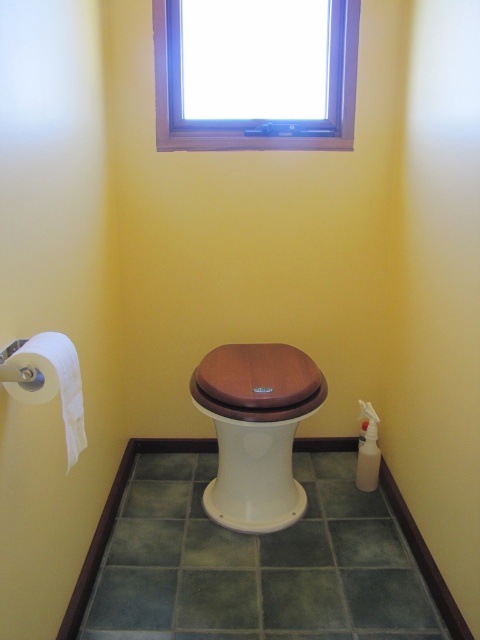
Which of these two, wooden frame at upper center or white paper at left, stands taller?

With more height is wooden frame at upper center.

Is point (300, 67) more distant than point (43, 365)?

Yes, point (300, 67) is farther from viewer.

Is point (235, 148) positioned behind point (69, 362)?

Yes, point (235, 148) is farther from viewer.

Where is `wooden frame at upper center`? wooden frame at upper center is located at coordinates (254, 74).

Image resolution: width=480 pixels, height=640 pixels. Describe the element at coordinates (257, 374) in the screenshot. I see `wooden toilet lid at center` at that location.

Based on the photo, does wooden toilet lid at center have a greater width compared to white paper at left?

Indeed, wooden toilet lid at center has a greater width compared to white paper at left.

Does point (320, 371) lie behind point (74, 353)?

Yes.

Image resolution: width=480 pixels, height=640 pixels. Identify the location of wooden toilet lid at center. (257, 374).

Who is positioned more to the right, brown matte toilet at center or wooden toilet lid at center?

From the viewer's perspective, wooden toilet lid at center appears more on the right side.

This screenshot has height=640, width=480. Describe the element at coordinates (253, 474) in the screenshot. I see `brown matte toilet at center` at that location.

The width and height of the screenshot is (480, 640). I want to click on brown matte toilet at center, so click(x=253, y=474).